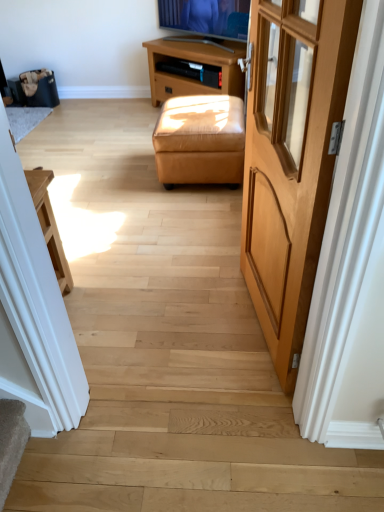
What are the coordinates of `free area behind light brown wood door at right` in the screenshot? It's located at (208, 259).